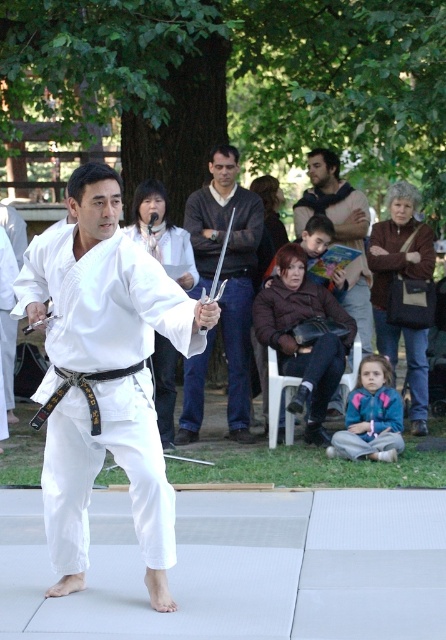
Question: Which point is closer to the camera?

Choices:
 (A) matte black sweater at center
 (B) brown leather jacket at center

Answer: (A)

Question: Estimate the real-world distances between objects in this image. Which object is closer to the white cotton kimono at center?

Choices:
 (A) matte black sweater at center
 (B) brown leather jacket at center

Answer: (A)

Question: Among these points, which one is farthest from the camera?

Choices:
 (A) (57, 566)
 (B) (248, 387)
 (C) (294, 230)

Answer: (C)

Question: Is white cotton kimono at center wider than matte black sweater at center?

Choices:
 (A) yes
 (B) no

Answer: (A)

Question: Can you confirm if matte black sweater at center is positioned to the left of brown leather jacket at center?

Choices:
 (A) no
 (B) yes

Answer: (B)

Question: Is matte black sweater at center bigger than brown leather jacket at center?

Choices:
 (A) yes
 (B) no

Answer: (A)